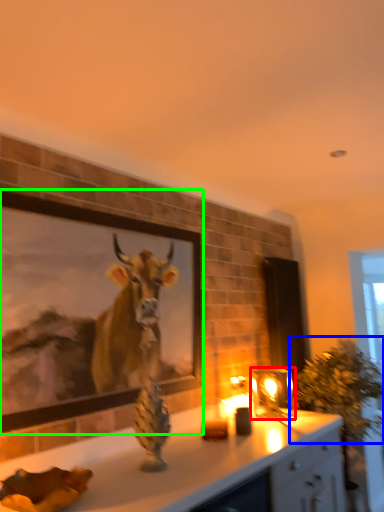
Question: Based on their relative distances, which object is nearer to candle holder (highlighted by a red box)? Choose from plant (highlighted by a blue box) and picture frame (highlighted by a green box).

Choices:
 (A) plant
 (B) picture frame

Answer: (A)